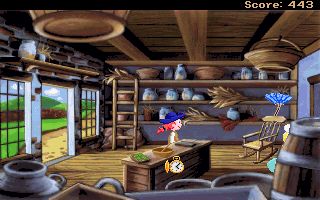
At what (x,y) coordinates should I click in order to perform the action: click on windows. Please return your answer as a coordinate pair (x, y). Image resolution: width=320 pixels, height=200 pixels. Looking at the image, I should click on (15, 117), (95, 108).